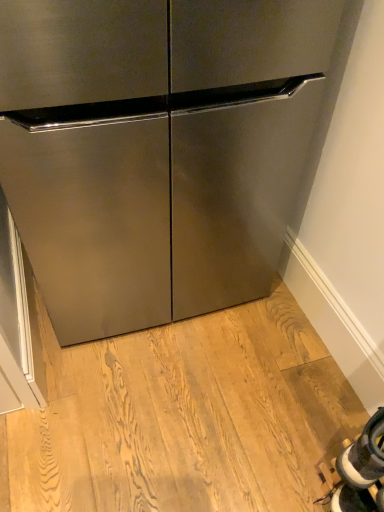
Measure the distance between stainless steel refrigerator at center and camera.

The distance of stainless steel refrigerator at center from camera is 28.62 inches.

This screenshot has width=384, height=512. What do you see at coordinates (160, 148) in the screenshot?
I see `stainless steel refrigerator at center` at bounding box center [160, 148].

In order to face stainless steel refrigerator at center, should I rotate leftwards or rightwards?

You should rotate left by 5.899 degrees.

Locate an element on the screen. This screenshot has height=512, width=384. stainless steel refrigerator at center is located at coordinates point(160,148).

The image size is (384, 512). What do you see at coordinates (364, 455) in the screenshot?
I see `white fabric shoe at lower right` at bounding box center [364, 455].

At what (x,y) coordinates should I click in order to perform the action: click on white fabric shoe at lower right. Please return your answer as a coordinate pair (x, y). Looking at the image, I should click on (364, 455).

Identify the location of stainless steel refrigerator at center. The width and height of the screenshot is (384, 512). (160, 148).

Considering the positions of objects stainless steel refrigerator at center and white fabric shoe at lower right in the image provided, who is more to the right, stainless steel refrigerator at center or white fabric shoe at lower right?

From the viewer's perspective, white fabric shoe at lower right appears more on the right side.

Is stainless steel refrigerator at center positioned before white fabric shoe at lower right?

Yes, the depth of stainless steel refrigerator at center is less than that of white fabric shoe at lower right.

Is point (207, 179) closer to viewer compared to point (366, 446)?

No, (207, 179) is behind (366, 446).

In the scene shown: From the image's perspective, is stainless steel refrigerator at center above white fabric shoe at lower right?

Yes, from the image's perspective, stainless steel refrigerator at center is over white fabric shoe at lower right.

From a real-world perspective, between stainless steel refrigerator at center and white fabric shoe at lower right, who is vertically higher?

stainless steel refrigerator at center.

Is stainless steel refrigerator at center wider than white fabric shoe at lower right?

Yes, stainless steel refrigerator at center is wider than white fabric shoe at lower right.

Can you confirm if stainless steel refrigerator at center is taller than white fabric shoe at lower right?

Yes, stainless steel refrigerator at center is taller than white fabric shoe at lower right.

Based on the photo, in terms of size, does stainless steel refrigerator at center appear bigger or smaller than white fabric shoe at lower right?

stainless steel refrigerator at center is bigger than white fabric shoe at lower right.

Is stainless steel refrigerator at center not inside white fabric shoe at lower right?

Absolutely, stainless steel refrigerator at center is external to white fabric shoe at lower right.

Is stainless steel refrigerator at center far away from white fabric shoe at lower right?

That's not correct — stainless steel refrigerator at center is a little close to white fabric shoe at lower right.

Consider the image. Could you tell me if stainless steel refrigerator at center is facing white fabric shoe at lower right?

Yes, stainless steel refrigerator at center is turned towards white fabric shoe at lower right.

How different are the orientations of stainless steel refrigerator at center and white fabric shoe at lower right in degrees?

The facing directions of stainless steel refrigerator at center and white fabric shoe at lower right are 81.1 degrees apart.

Where is `shoe that is below the stainless steel refrigerator at center (from the image's perspective)`? shoe that is below the stainless steel refrigerator at center (from the image's perspective) is located at coordinates (364, 455).

Is white fabric shoe at lower right to the left or to the right of stainless steel refrigerator at center in the image?

Clearly, white fabric shoe at lower right is on the right of stainless steel refrigerator at center in the image.

Is the position of white fabric shoe at lower right less distant than that of stainless steel refrigerator at center?

No, the depth of white fabric shoe at lower right is greater than that of stainless steel refrigerator at center.

Considering the positions of point (363, 454) and point (55, 260), is point (363, 454) closer or farther from the camera than point (55, 260)?

Point (363, 454).

From the image's perspective, is white fabric shoe at lower right located above stainless steel refrigerator at center?

Incorrect, from the image's perspective, white fabric shoe at lower right is lower than stainless steel refrigerator at center.

From a real-world perspective, is white fabric shoe at lower right above or below stainless steel refrigerator at center?

Clearly, from a real-world perspective, white fabric shoe at lower right is below stainless steel refrigerator at center.

Can you confirm if white fabric shoe at lower right is thinner than stainless steel refrigerator at center?

Correct, the width of white fabric shoe at lower right is less than that of stainless steel refrigerator at center.

Who is shorter, white fabric shoe at lower right or stainless steel refrigerator at center?

With less height is white fabric shoe at lower right.

Is white fabric shoe at lower right bigger than stainless steel refrigerator at center?

Actually, white fabric shoe at lower right might be smaller than stainless steel refrigerator at center.

Is white fabric shoe at lower right outside of stainless steel refrigerator at center?

That's correct, white fabric shoe at lower right is outside of stainless steel refrigerator at center.

Are white fabric shoe at lower right and stainless steel refrigerator at center located far from each other?

No, there isn't a large distance between white fabric shoe at lower right and stainless steel refrigerator at center.

Could you tell me if white fabric shoe at lower right is facing stainless steel refrigerator at center?

No, white fabric shoe at lower right is not facing towards stainless steel refrigerator at center.

How many degrees apart are the facing directions of white fabric shoe at lower right and stainless steel refrigerator at center?

The angular difference between white fabric shoe at lower right and stainless steel refrigerator at center is 81.1 degrees.

Identify the location of cabinetry on the left of white fabric shoe at lower right. The width and height of the screenshot is (384, 512). (160, 148).

At what (x,y) coordinates should I click in order to perform the action: click on shoe below the stainless steel refrigerator at center (from a real-world perspective). Please return your answer as a coordinate pair (x, y). This screenshot has width=384, height=512. Looking at the image, I should click on (364, 455).

Find the location of a particular element. cabinetry lying on the left of white fabric shoe at lower right is located at coordinates (160, 148).